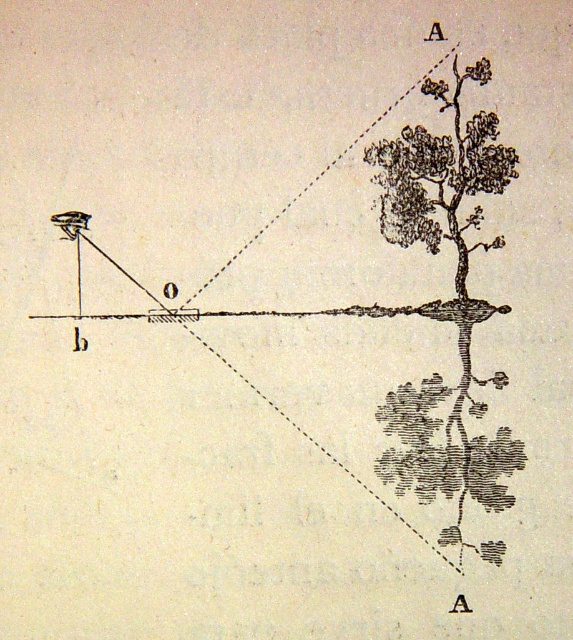
Question: Which point is farther to the camera?

Choices:
 (A) (241, 248)
 (B) (431, 177)

Answer: (A)

Question: Is black textured tree at upper right smaller than matte black rectangle at center?

Choices:
 (A) yes
 (B) no

Answer: (A)

Question: Which point is closer to the camera?

Choices:
 (A) (431, 212)
 (B) (115, 262)
 (C) (473, 148)

Answer: (C)

Question: Does black textured tree at right have a greater width compared to matte black rectangle at center?

Choices:
 (A) no
 (B) yes

Answer: (A)

Question: Does black textured tree at right have a lesser width compared to matte black rectangle at center?

Choices:
 (A) no
 (B) yes

Answer: (B)

Question: Which point is farther from the camera taking this photo?

Choices:
 (A) (465, 276)
 (B) (154, 298)
 (C) (484, 410)

Answer: (A)